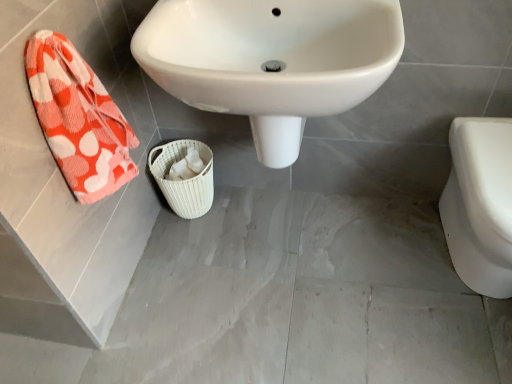
Image resolution: width=512 pixels, height=384 pixels. In order to click on empty space that is to the right of white woven basket at center in this screenshot , I will do `click(247, 209)`.